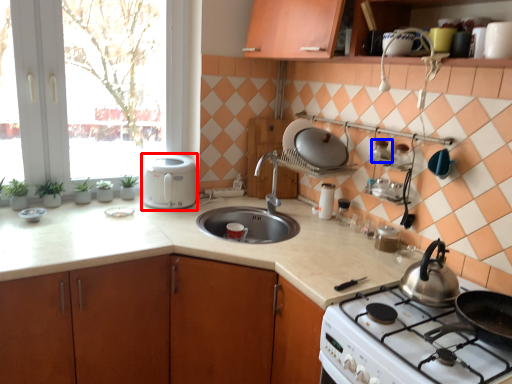
Question: Among these objects, which one is nearest to the camera, kitchen appliance (highlighted by a red box) or appliance (highlighted by a blue box)?

Choices:
 (A) kitchen appliance
 (B) appliance

Answer: (B)